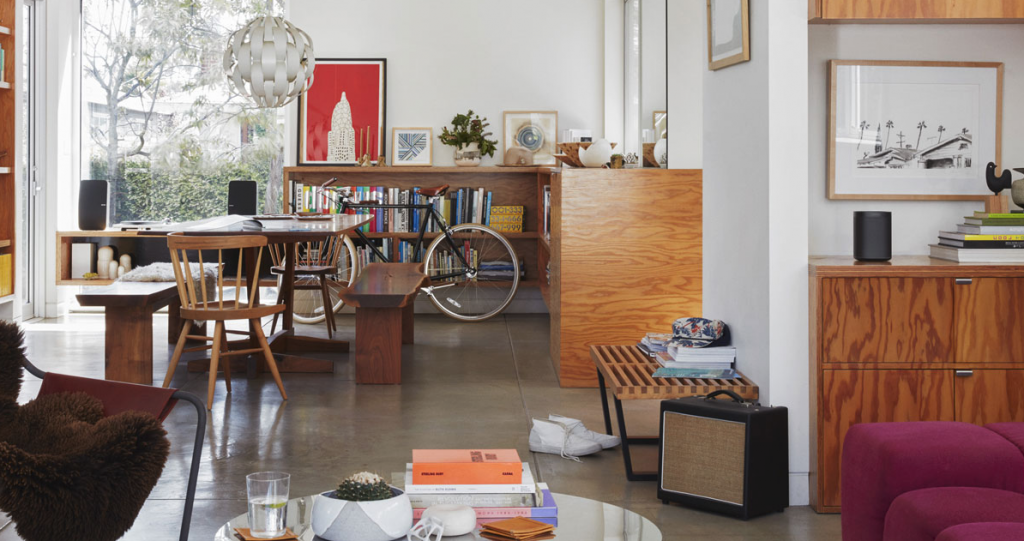
Locate an element on the screen. The image size is (1024, 541). stuffed chair is located at coordinates (936, 466).